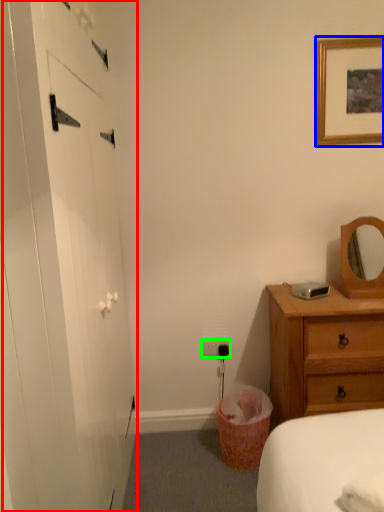
Question: Which is nearer to the barn door (highlighted by a red box)? picture frame (highlighted by a blue box) or electric outlet (highlighted by a green box).

Choices:
 (A) picture frame
 (B) electric outlet

Answer: (B)